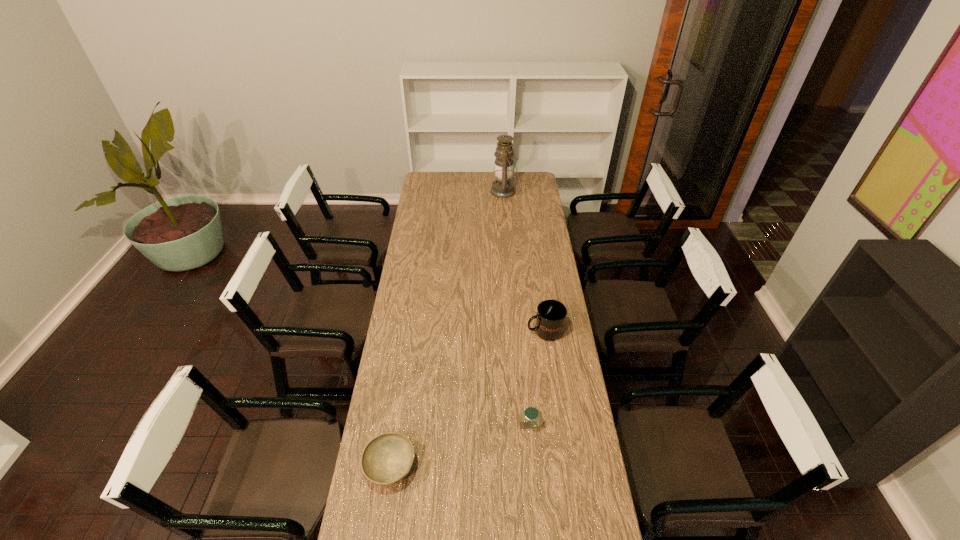
Where is `oil lamp`? This screenshot has width=960, height=540. oil lamp is located at coordinates (502, 187).

Identify the location of the tallest object. (502, 187).

Identify the location of the second tallest object. The height and width of the screenshot is (540, 960). (551, 315).

Where is `mug`? Image resolution: width=960 pixels, height=540 pixels. mug is located at coordinates (551, 315).

Find the location of a particular element. This screenshot has height=540, width=960. the second nearest object is located at coordinates (531, 414).

The width and height of the screenshot is (960, 540). Find the location of `watch`. watch is located at coordinates (531, 414).

Image resolution: width=960 pixels, height=540 pixels. I want to click on the nearest object, so click(387, 458).

Locate an element on the screen. the shortest object is located at coordinates (387, 458).

The image size is (960, 540). Find the location of `vacant area situated on the front of the tallest object`. vacant area situated on the front of the tallest object is located at coordinates (507, 218).

This screenshot has height=540, width=960. I want to click on blank space located with the handle on the side of the third nearest object, so click(456, 331).